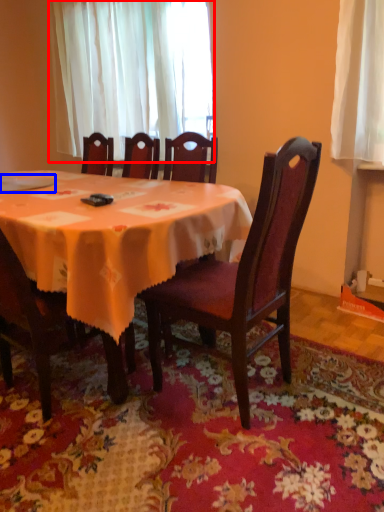
Question: Which object is closer to the camera taking this photo, curtain (highlighted by a red box) or tableware (highlighted by a blue box)?

Choices:
 (A) curtain
 (B) tableware

Answer: (B)